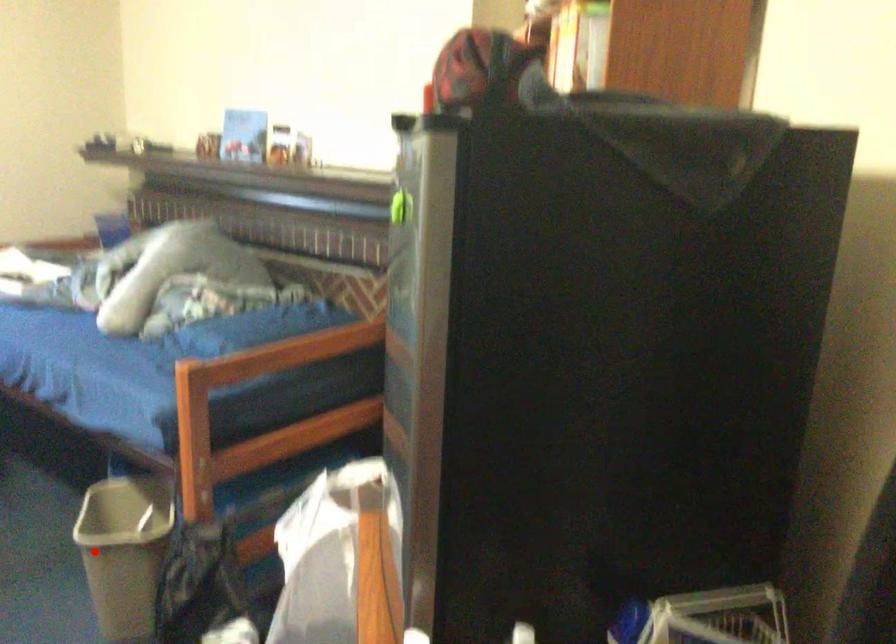
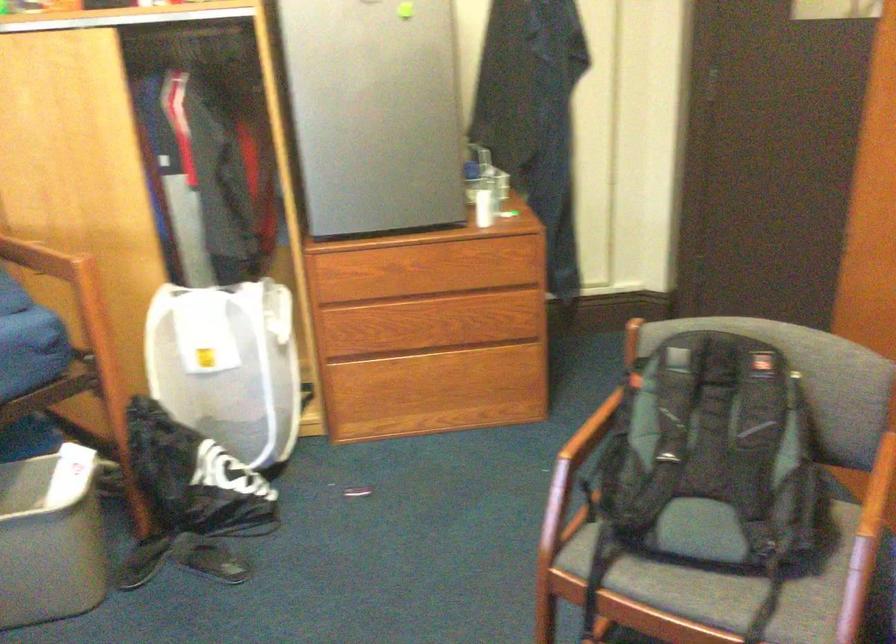
Where in the second image is the point corresponding to the highlighted location from the first image?

(49, 538)